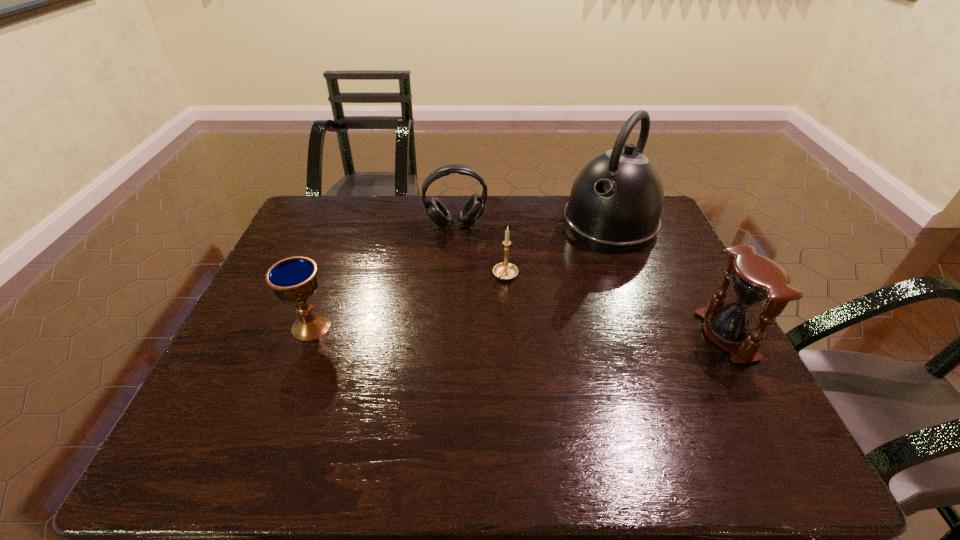
Image resolution: width=960 pixels, height=540 pixels. Find the location of `free location located 0.100m on the earcups of the second object from left to right`. free location located 0.100m on the earcups of the second object from left to right is located at coordinates (464, 253).

This screenshot has height=540, width=960. Identify the location of vacant space located 0.350m on the handle side of the third nearest object. (452, 388).

The height and width of the screenshot is (540, 960). In order to click on vacant area situated 0.250m on the handle side of the third nearest object in this screenshot , I will do `click(468, 354)`.

Identify the location of free spot located 0.190m on the handle side of the third nearest object. The height and width of the screenshot is (540, 960). (477, 336).

Image resolution: width=960 pixels, height=540 pixels. Find the location of `vacant point located 0.310m on the spout of the kettle`. vacant point located 0.310m on the spout of the kettle is located at coordinates (540, 307).

The image size is (960, 540). In order to click on vacant space situated 0.210m on the spout of the kettle in this screenshot , I will do `click(558, 286)`.

In order to click on free space located 0.350m on the spout of the kettle in this screenshot , I will do `click(532, 316)`.

Identify the location of headset that is at the far edge. tap(473, 208).

What are the coordinates of `kettle at the far edge` in the screenshot? It's located at (615, 204).

Image resolution: width=960 pixels, height=540 pixels. Identify the location of object located in the left edge section of the desktop. (294, 279).